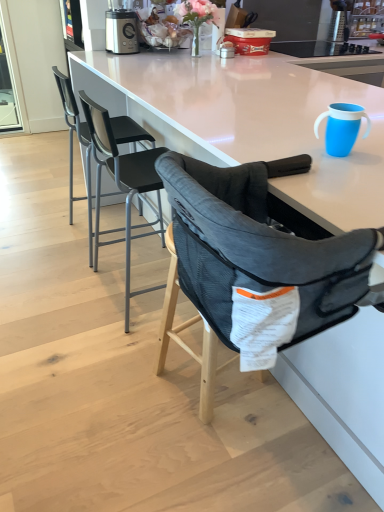
Find the location of a particular element. The height and width of the screenshot is (512, 384). free space between metallic silver blender at upper center and blue plastic cup at upper right is located at coordinates click(198, 89).